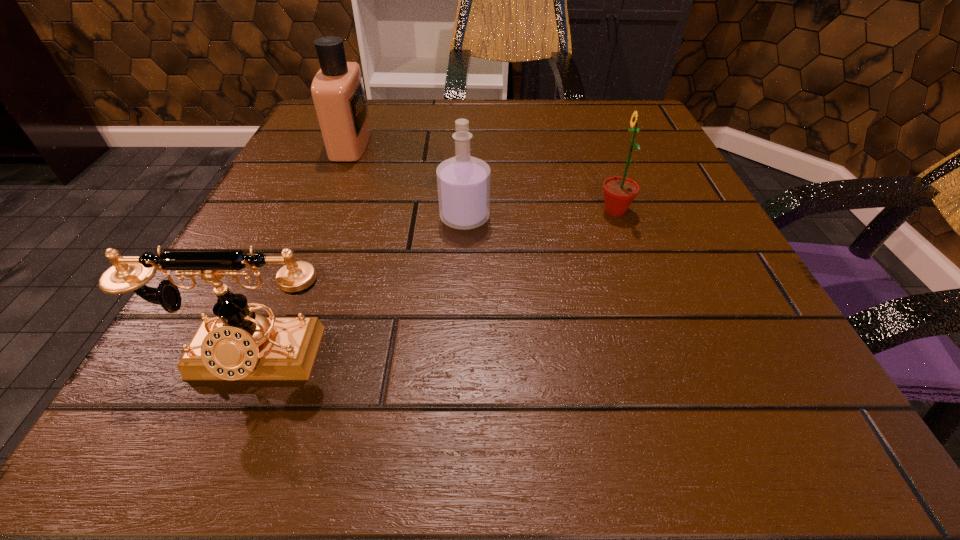
The width and height of the screenshot is (960, 540). Identify the location of vacant space in between the telephone and the right perfume. (358, 288).

You are a GUI agent. You are given a task and a screenshot of the screen. Output one action in this format:
    pyautogui.click(x=<x>, y=<y>)
    Task: Click on the unoccupied area between the nearest object and the sunflower
    
    Given the screenshot: What is the action you would take?
    pyautogui.click(x=433, y=285)

You are a GUI agent. You are given a task and a screenshot of the screen. Output one action in this format:
    pyautogui.click(x=<x>, y=<y>)
    Task: Click on the vacant space in between the sunflower and the nearest object
    This screenshot has width=960, height=540.
    Given the screenshot: What is the action you would take?
    pyautogui.click(x=433, y=285)

Identify which object is the second closest to the right perfume. Please provide its 2D coordinates. Your answer should be formatted as a tuple, i.e. [(x, y)], where the tuple contains the x and y coordinates of a point satisfying the conditions above.

[(337, 89)]

Where is `object that stands as the closest to the rightmost object`? This screenshot has height=540, width=960. object that stands as the closest to the rightmost object is located at coordinates (463, 181).

Find the location of a particular element. vacant space that satisfies the following two spatial constraints: 1. on the front label of the nearer perfume; 2. on the right side of the farther perfume is located at coordinates (320, 218).

I want to click on blank space that satisfies the following two spatial constraints: 1. on the front label of the left perfume; 2. on the left side of the nearer perfume, so click(x=320, y=218).

This screenshot has width=960, height=540. I want to click on free point that satisfies the following two spatial constraints: 1. on the front label of the farthest object; 2. on the back side of the second object from right to left, so click(320, 218).

You are a GUI agent. You are given a task and a screenshot of the screen. Output one action in this format:
    pyautogui.click(x=<x>, y=<y>)
    Task: Click on the vacant position in the image that satisfies the following two spatial constraints: 1. on the front label of the farthest object; 2. on the back side of the shorter perfume
    
    Given the screenshot: What is the action you would take?
    pyautogui.click(x=320, y=218)

Locate an element on the screen. This screenshot has width=960, height=540. blank space that satisfies the following two spatial constraints: 1. on the front label of the farther perfume; 2. on the dial of the nearest object is located at coordinates (261, 358).